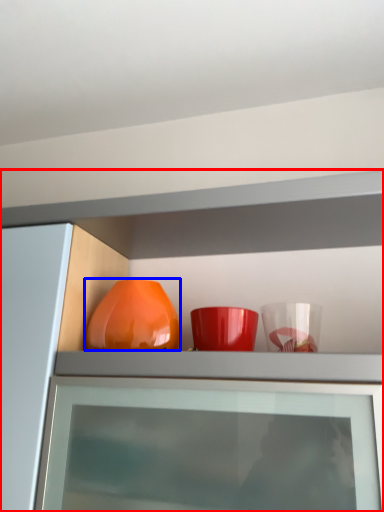
Question: Which object appears closest to the camera in this image, cabinetry (highlighted by a red box) or vase (highlighted by a blue box)?

Choices:
 (A) cabinetry
 (B) vase

Answer: (A)